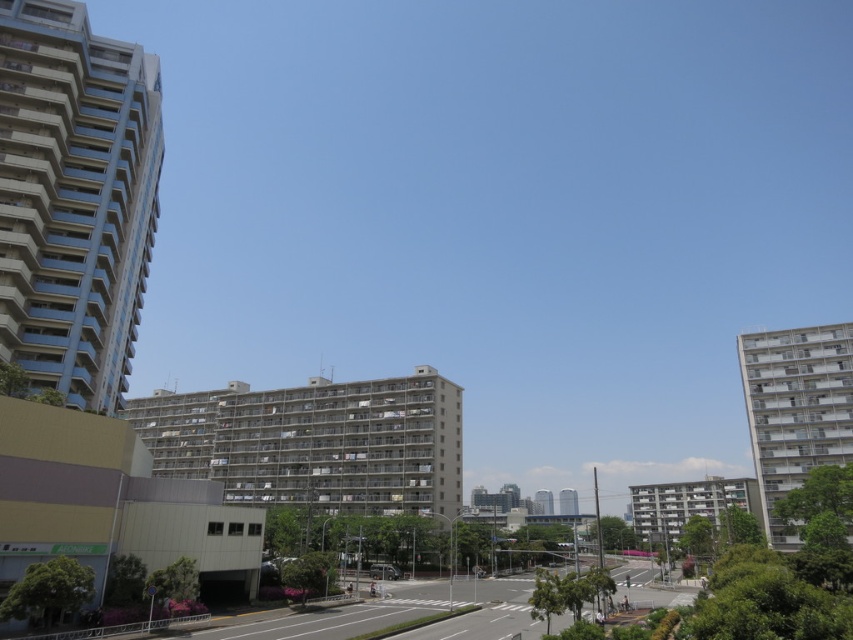
Is white concrete building at center wider than metallic silver van at center?

Yes, white concrete building at center is wider than metallic silver van at center.

Who is more forward, [564,500] or [376,570]?

Point [376,570]

Where is `white concrete building at center`? The height and width of the screenshot is (640, 853). white concrete building at center is located at coordinates (567, 500).

Between point (73, 104) and point (560, 492), which one is positioned in front?

Point (73, 104) is more forward.

Is point (64, 380) positioned before point (560, 508)?

Yes, it is.

The width and height of the screenshot is (853, 640). Identify the location of light blue concrete building at left. coord(74,198).

Measure the distance between light blue concrete building at left and camera.

light blue concrete building at left is 172.00 feet away from camera.

Which is above, light blue concrete building at left or smooth concrete tower at center?

light blue concrete building at left

Is point (73, 332) positioned in front of point (548, 499)?

Yes, point (73, 332) is closer to viewer.

The height and width of the screenshot is (640, 853). In order to click on light blue concrete building at left in this screenshot , I will do `click(74, 198)`.